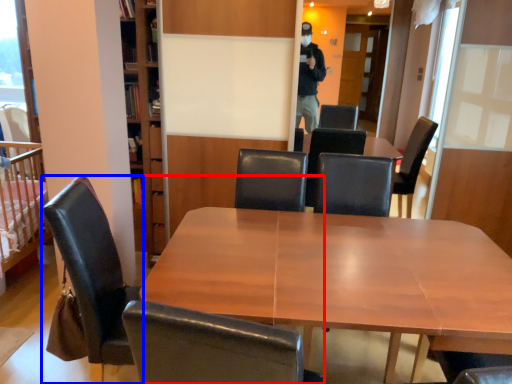
Question: Which point is further to the camera, chair (highlighted by a red box) or chair (highlighted by a blue box)?

Choices:
 (A) chair
 (B) chair

Answer: (B)